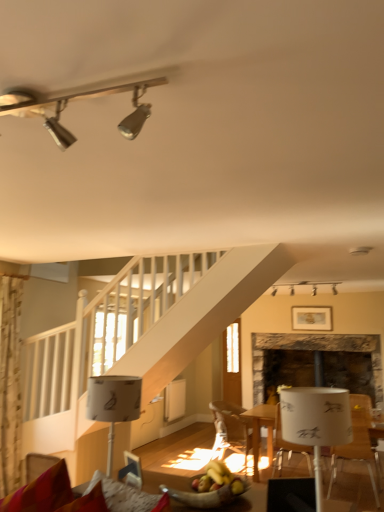
Question: Is velvet red couch at lower left located outside clear glass door at center?

Choices:
 (A) no
 (B) yes

Answer: (B)

Question: Is velvet red couch at lower left bigger than clear glass door at center?

Choices:
 (A) no
 (B) yes

Answer: (A)

Question: Is velvet red couch at lower left taller than clear glass door at center?

Choices:
 (A) yes
 (B) no

Answer: (B)

Question: Is velvet red couch at lower left shorter than clear glass door at center?

Choices:
 (A) yes
 (B) no

Answer: (A)

Question: From the image's perspective, is velvet red couch at lower left on top of clear glass door at center?

Choices:
 (A) yes
 (B) no

Answer: (A)

Question: Is white plastic chair at lower right, which is counted as the 2th chair, starting from the back, in front of or behind clear glass door at center in the image?

Choices:
 (A) front
 (B) behind

Answer: (A)

Question: From a real-world perspective, is white plastic chair at lower right, which is counted as the second chair, starting from the left, above or below clear glass door at center?

Choices:
 (A) above
 (B) below

Answer: (B)

Question: Considering the positions of white plastic chair at lower right, the first chair when ordered from front to back, and clear glass door at center in the image, is white plastic chair at lower right, the first chair when ordered from front to back, taller or shorter than clear glass door at center?

Choices:
 (A) tall
 (B) short

Answer: (B)

Question: Considering the positions of white plastic chair at lower right, which is counted as the 2th chair, starting from the back, and clear glass door at center in the image, is white plastic chair at lower right, which is counted as the 2th chair, starting from the back, bigger or smaller than clear glass door at center?

Choices:
 (A) big
 (B) small

Answer: (A)

Question: Considering the positions of wooden bowl of fruit at lower center and white paper lampshade at lower left, which is the first lamp in bottom-to-top order, in the image, is wooden bowl of fruit at lower center bigger or smaller than white paper lampshade at lower left, which is the first lamp in bottom-to-top order,?

Choices:
 (A) small
 (B) big

Answer: (A)

Question: In the image, is wooden bowl of fruit at lower center positioned in front of or behind white paper lampshade at lower left, the second lamp from the back?

Choices:
 (A) front
 (B) behind

Answer: (A)

Question: Considering the positions of wooden bowl of fruit at lower center and white paper lampshade at lower left, which is the 3th lamp from top to bottom, in the image, is wooden bowl of fruit at lower center wider or thinner than white paper lampshade at lower left, which is the 3th lamp from top to bottom,?

Choices:
 (A) thin
 (B) wide

Answer: (A)

Question: From the image's perspective, is wooden bowl of fruit at lower center positioned above or below white paper lampshade at lower left, arranged as the 1th lamp when viewed from the left?

Choices:
 (A) below
 (B) above

Answer: (A)

Question: Considering the positions of point (46, 125) and point (97, 389), is point (46, 125) closer or farther from the camera than point (97, 389)?

Choices:
 (A) closer
 (B) farther

Answer: (A)

Question: Is metallic track lighting at upper left, the first lamp when ordered from front to back, wider or thinner than white paper lampshade at lower left, which is the 3th lamp from top to bottom?

Choices:
 (A) wide
 (B) thin

Answer: (B)